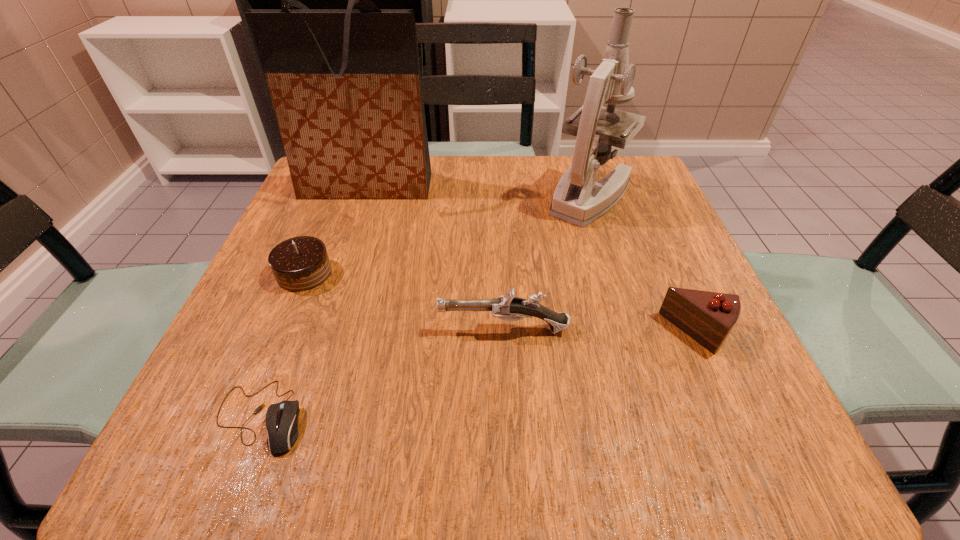
Locate which object ranks fifth in proximity to the right chocolate cake. Please provide its 2D coordinates. Your answer should be formatted as a tuple, i.e. [(x, y)], where the tuple contains the x and y coordinates of a point satisfying the conditions above.

[(301, 263)]

Select which object appears as the third closest to the shopping bag. Please provide its 2D coordinates. Your answer should be formatted as a tuple, i.e. [(x, y)], where the tuple contains the x and y coordinates of a point satisfying the conditions above.

[(507, 307)]

The width and height of the screenshot is (960, 540). Identify the location of vacant area that satisfies the following two spatial constraints: 1. on the front-facing side of the microscope; 2. on the left side of the shopping bag. (363, 195).

Find the location of a particular element. This screenshot has width=960, height=540. vacant region that satisfies the following two spatial constraints: 1. on the back side of the nearer chocolate cake; 2. aimed along the barrel of the third object from right to left is located at coordinates (696, 329).

The width and height of the screenshot is (960, 540). What are the coordinates of `free space in the image that satisfies the following two spatial constraints: 1. on the front-facing side of the shopping bag; 2. on the left side of the microscope` in the screenshot? It's located at (363, 195).

Identify the location of free spot that satisfies the following two spatial constraints: 1. on the front-facing side of the microscope; 2. on the right side of the shopping bag. (363, 195).

Image resolution: width=960 pixels, height=540 pixels. I want to click on vacant space that satisfies the following two spatial constraints: 1. aimed along the barrel of the gun; 2. on the left side of the right chocolate cake, so click(504, 332).